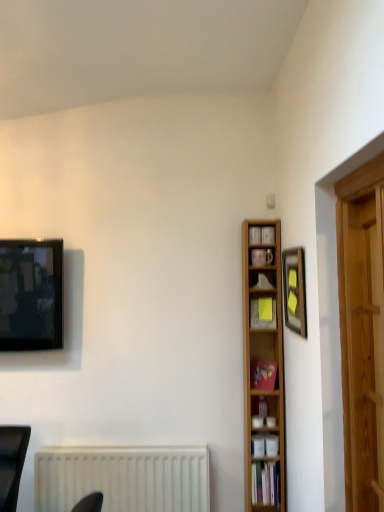
Question: From a real-world perspective, is wooden bookcase at right under wooden framed picture at upper right?

Choices:
 (A) no
 (B) yes

Answer: (B)

Question: Is wooden bookcase at right outside wooden framed picture at upper right?

Choices:
 (A) yes
 (B) no

Answer: (A)

Question: From the image's perspective, is wooden bookcase at right beneath wooden framed picture at upper right?

Choices:
 (A) no
 (B) yes

Answer: (B)

Question: Does wooden bookcase at right have a greater height compared to wooden framed picture at upper right?

Choices:
 (A) yes
 (B) no

Answer: (A)

Question: Can you confirm if wooden bookcase at right is shorter than wooden framed picture at upper right?

Choices:
 (A) yes
 (B) no

Answer: (B)

Question: From a real-world perspective, relative to wooden framed picture at upper right, is wooden bookcase at right vertically above or below?

Choices:
 (A) below
 (B) above

Answer: (A)

Question: Considering their positions, is wooden bookcase at right located in front of or behind wooden framed picture at upper right?

Choices:
 (A) front
 (B) behind

Answer: (B)

Question: Looking at the image, does wooden bookcase at right seem bigger or smaller compared to wooden framed picture at upper right?

Choices:
 (A) big
 (B) small

Answer: (A)

Question: In the image, is wooden bookcase at right on the left side or the right side of wooden framed picture at upper right?

Choices:
 (A) right
 (B) left

Answer: (B)

Question: Is wooden framed picture at upper right taller or shorter than wooden bookcase at right?

Choices:
 (A) short
 (B) tall

Answer: (A)

Question: Is wooden framed picture at upper right situated inside wooden bookcase at right or outside?

Choices:
 (A) inside
 (B) outside

Answer: (B)

Question: Is wooden framed picture at upper right wider or thinner than wooden bookcase at right?

Choices:
 (A) thin
 (B) wide

Answer: (A)

Question: From a real-world perspective, is wooden framed picture at upper right physically located above or below wooden bookcase at right?

Choices:
 (A) below
 (B) above

Answer: (B)

Question: Considering the positions of point (243, 305) and point (263, 326), is point (243, 305) closer or farther from the camera than point (263, 326)?

Choices:
 (A) closer
 (B) farther

Answer: (B)

Question: In terms of size, does wooden bookcase at right appear bigger or smaller than matte yellow sticky note at center-right, arranged as the third book when ordered from the bottom?

Choices:
 (A) small
 (B) big

Answer: (B)